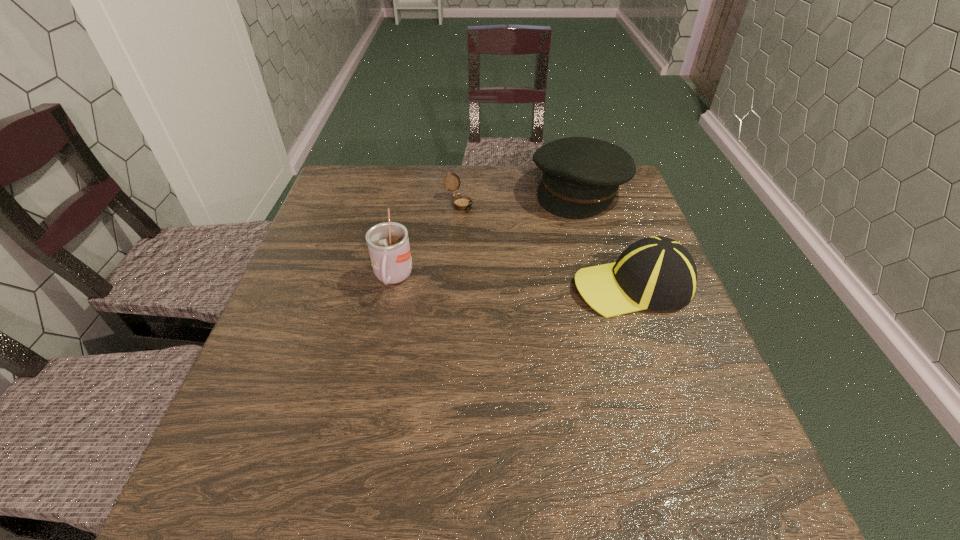
This screenshot has width=960, height=540. In order to click on vacant spot on the desktop that is between the cup and the baseball cap and is positioned on the face of the shortest object in this screenshot , I will do `click(542, 282)`.

Find the location of a particular element. The image size is (960, 540). vacant space on the desktop that is between the cup and the baseball cap and is positioned on the front-facing side of the beret is located at coordinates (511, 282).